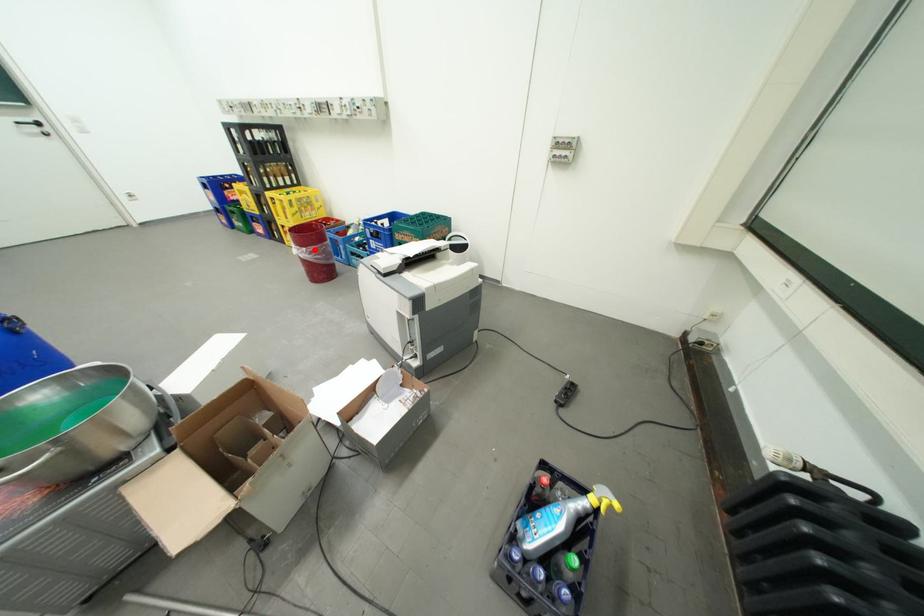
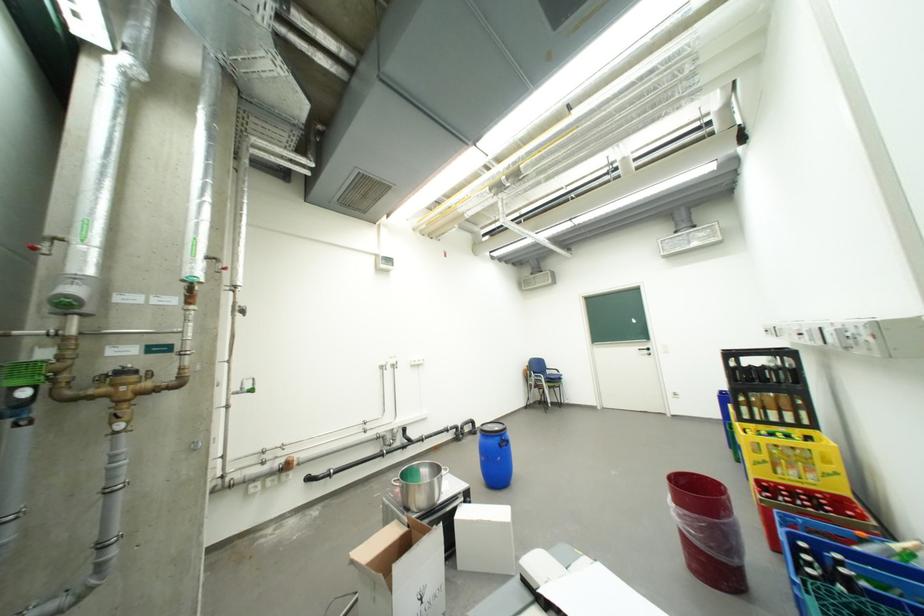
Question: I am providing you with two images of the same scene from different viewpoints. Given a red point in image1, look at the same physical point in image2. Is it:

Choices:
 (A) Closer to the viewpoint
 (B) Farther from the viewpoint

Answer: (B)